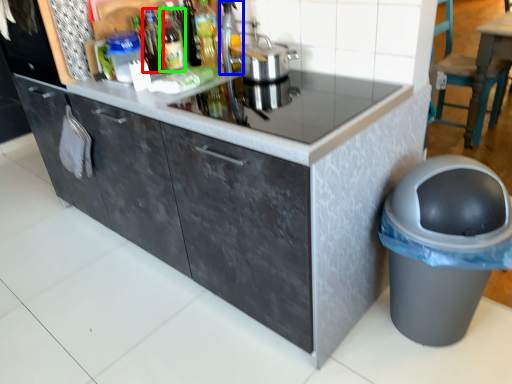
Question: Considering the real-world distances, which object is closest to bottle (highlighted by a red box)? appliance (highlighted by a blue box) or bottle (highlighted by a green box).

Choices:
 (A) appliance
 (B) bottle

Answer: (B)